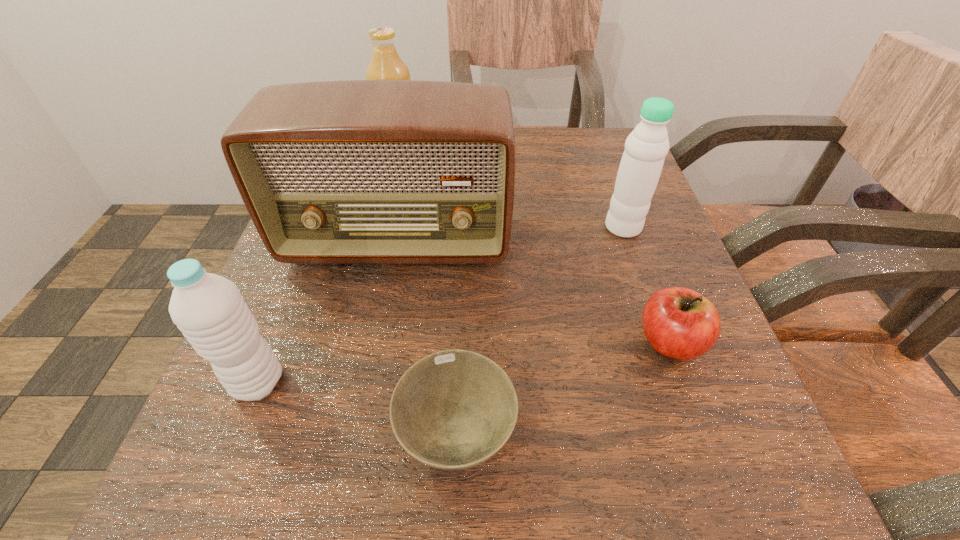
Image resolution: width=960 pixels, height=540 pixels. What are the coordinates of `vacant space located on the left of the fifth tallest object` in the screenshot? It's located at tap(516, 342).

This screenshot has height=540, width=960. In order to click on free space located 0.060m on the left of the bowl in this screenshot , I will do `click(348, 433)`.

I want to click on object present at the far edge, so click(x=385, y=64).

Identify the location of object that is positioned at the near edge. This screenshot has width=960, height=540. (454, 409).

Locate an element on the screen. The height and width of the screenshot is (540, 960). olive oil at the left edge is located at coordinates (385, 64).

Identify the location of radio receiver at the left edge. (359, 171).

This screenshot has width=960, height=540. What are the coordinates of `water bottle that is at the left edge` in the screenshot? It's located at (209, 310).

Locate an element on the screen. The width and height of the screenshot is (960, 540). water bottle that is at the right edge is located at coordinates (640, 168).

I want to click on apple that is positioned at the right edge, so click(x=680, y=323).

I want to click on object situated at the far left corner, so click(x=385, y=64).